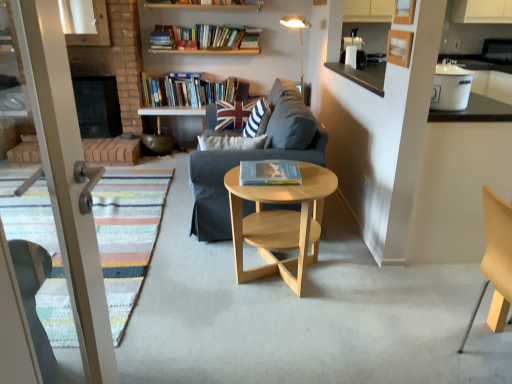
Question: Does point (248, 125) appear closer or farther from the camera than point (266, 110)?

Choices:
 (A) farther
 (B) closer

Answer: (A)

Question: Considering the positions of white striped fabric pillow at center, marked as the first pillow in a front-to-back arrangement, and union jack fabric pillow at center, the 1th pillow in the back-to-front sequence, in the image, is white striped fabric pillow at center, marked as the first pillow in a front-to-back arrangement, bigger or smaller than union jack fabric pillow at center, the 1th pillow in the back-to-front sequence,?

Choices:
 (A) big
 (B) small

Answer: (B)

Question: Which is farther from the hardcover books at upper center, the first book positioned from the top?

Choices:
 (A) white glossy container at upper right
 (B) natural wood coffee table at center
 (C) dark gray fabric couch at center
 (D) white striped fabric pillow at center, marked as the first pillow in a front-to-back arrangement
 (E) union jack fabric pillow at center, the 1th pillow in the back-to-front sequence

Answer: (A)

Question: Which object is positioned farthest from the white striped fabric pillow at center, which is the 2th pillow in back-to-front order?

Choices:
 (A) hardcover books at upper center, which ranks as the 2th book in right-to-left order
 (B) white glossy container at upper right
 (C) hardcover book at center, which ranks as the second book in left-to-right order
 (D) metallic gold floor lamp at upper center
 (E) union jack fabric pillow at center, the 2th pillow in the front-to-back sequence

Answer: (D)